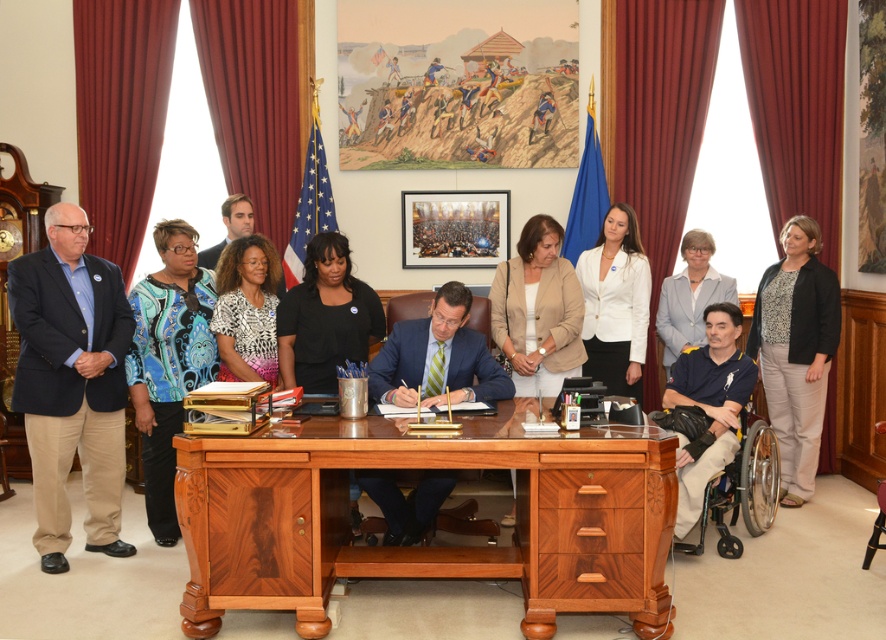
Between black textured blazer at right and blue shirt at right, which one is positioned higher?

blue shirt at right is above.

Does point (752, 326) come farther from viewer compared to point (688, 316)?

Yes, point (752, 326) is behind point (688, 316).

Where is `black textured blazer at right`? black textured blazer at right is located at coordinates (797, 352).

I want to click on black textured blazer at right, so click(797, 352).

Can you confirm if dark blue blazer at left is positioned to the right of matte black shirt at center?

In fact, dark blue blazer at left is to the left of matte black shirt at center.

Image resolution: width=886 pixels, height=640 pixels. What do you see at coordinates (71, 381) in the screenshot?
I see `dark blue blazer at left` at bounding box center [71, 381].

The height and width of the screenshot is (640, 886). Find the location of `dark blue blazer at left`. dark blue blazer at left is located at coordinates (71, 381).

Can you confirm if black textured blazer at right is positioned to the right of silver metallic wheelchair at lower right?

Yes, black textured blazer at right is to the right of silver metallic wheelchair at lower right.

Is point (797, 380) positioned after point (766, 458)?

Yes, it is.

Which is behind, point (779, 348) or point (705, 524)?

Point (779, 348)

I want to click on black textured blazer at right, so click(797, 352).